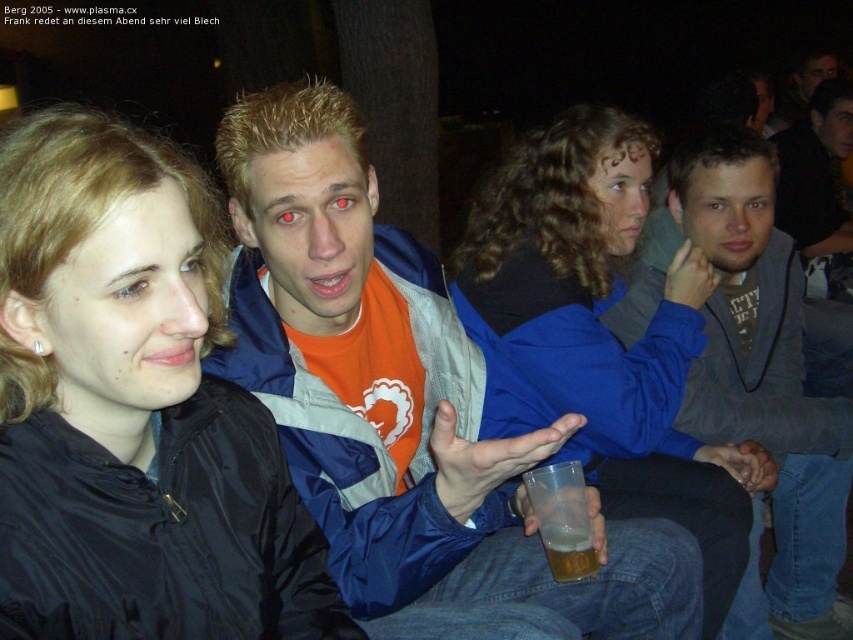
You are standing at the origin point of the image. Which of the two points, point (648,417) or point (793,612), is closer to you?

Point (648,417) is closer to you because it is in front of point (793,612).

You are a photographer trying to capture a closeup of the black matte jacket at center and the blue fabric jacket at center. Which jacket is closer to the camera?

The black matte jacket at center is positioned under the blue fabric jacket at center, so the blue fabric jacket at center is closer to the camera.

You are a photographer trying to decide which jacket to wear for an outdoor evening shoot. You have the blue fabric jacket at center and the gray fleece jacket at center. Based on the image, which jacket would provide better insulation against the cold?

The gray fleece jacket at center is thicker than the blue fabric jacket at center, so it would provide better insulation against the cold.